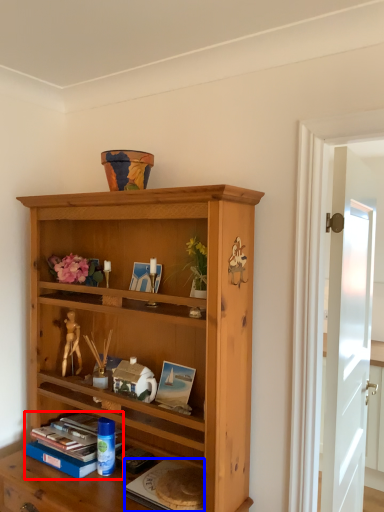
Question: Among these objects, which one is farthest to the camera, book (highlighted by a red box) or paperback book (highlighted by a blue box)?

Choices:
 (A) book
 (B) paperback book

Answer: (A)